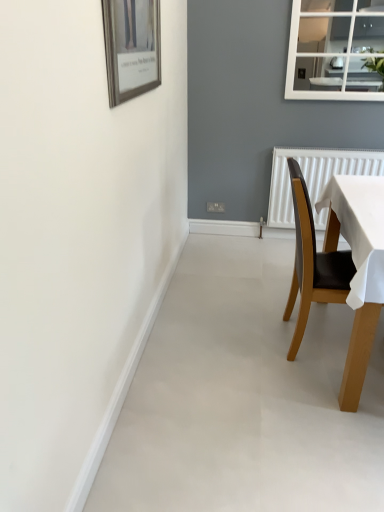
Where is `vacant space in front of brown wooden chair at right`? Image resolution: width=384 pixels, height=512 pixels. vacant space in front of brown wooden chair at right is located at coordinates coord(320,396).